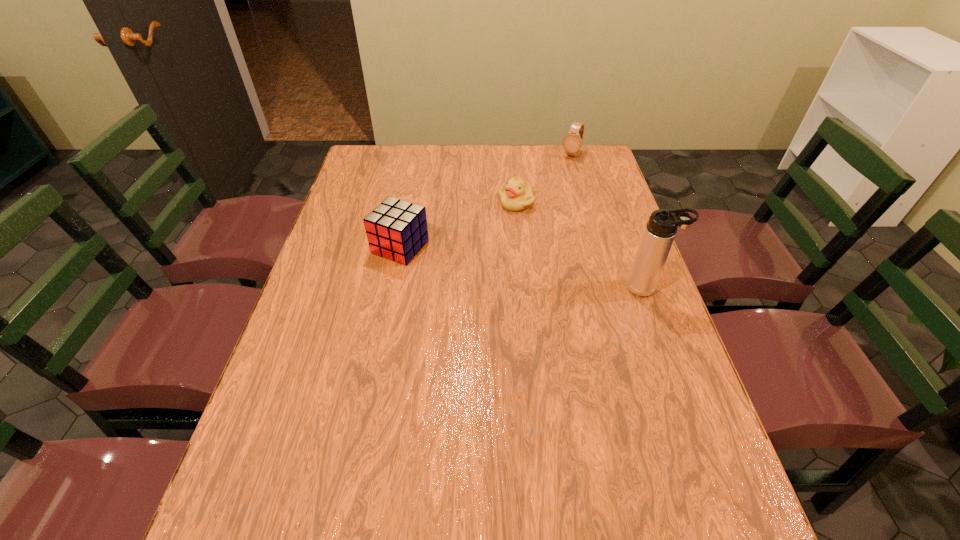
Where is `the leftmost object`? The width and height of the screenshot is (960, 540). the leftmost object is located at coordinates (397, 230).

This screenshot has width=960, height=540. I want to click on the third farthest object, so click(397, 230).

Identify the location of the tallest object. The width and height of the screenshot is (960, 540). (660, 231).

At what (x,y) coordinates should I click in order to perform the action: click on the rightmost object. Please return your answer as a coordinate pair (x, y). Looking at the image, I should click on (660, 231).

At what (x,y) coordinates should I click in order to perform the action: click on the second farthest object. Please return your answer as a coordinate pair (x, y). Looking at the image, I should click on coord(517,195).

Image resolution: width=960 pixels, height=540 pixels. In order to click on duckling in this screenshot , I will do `click(517, 195)`.

In order to click on the farthest object in this screenshot , I will do `click(572, 142)`.

The height and width of the screenshot is (540, 960). I want to click on the second object from right to left, so tap(572, 142).

Where is `vacant region located on the back of the leftmost object`? vacant region located on the back of the leftmost object is located at coordinates (410, 197).

This screenshot has height=540, width=960. Identify the location of free location located on the front-facing side of the duckling. (493, 273).